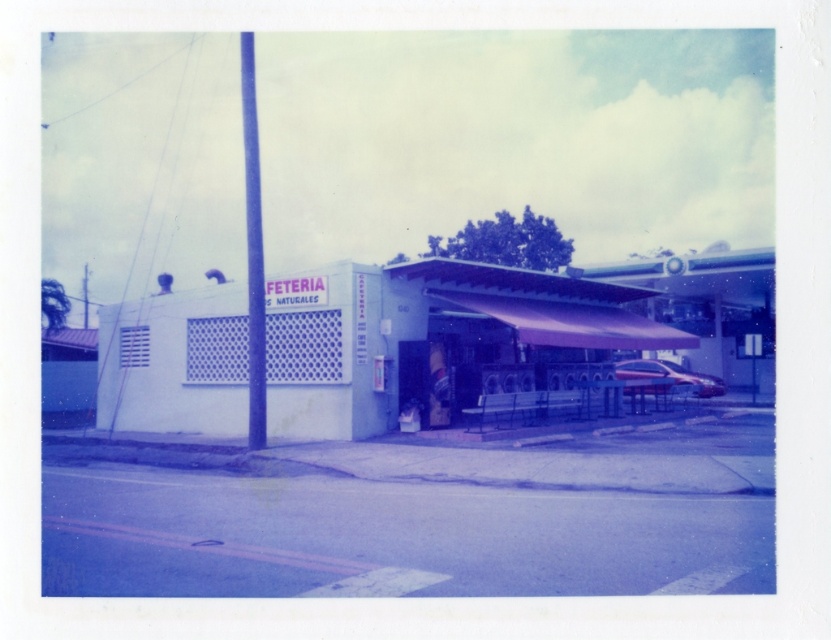
Question: Does white lattice wall at center have a lesser width compared to shiny silver car at center?

Choices:
 (A) no
 (B) yes

Answer: (A)

Question: Which of the following is the closest to the observer?

Choices:
 (A) [x=332, y=321]
 (B) [x=662, y=362]
 (C) [x=261, y=342]

Answer: (C)

Question: From the image, what is the correct spatial relationship of white lattice wall at center in relation to shiny silver car at center?

Choices:
 (A) left
 (B) right

Answer: (A)

Question: Considering the real-world distances, which object is closest to the smooth blue pole at center?

Choices:
 (A) shiny silver car at center
 (B) white lattice wall at center

Answer: (B)

Question: Which point is farther to the camera?

Choices:
 (A) smooth blue pole at center
 (B) shiny silver car at center
 (C) white lattice wall at center

Answer: (B)

Question: Can you confirm if white lattice wall at center is bigger than smooth blue pole at center?

Choices:
 (A) no
 (B) yes

Answer: (A)